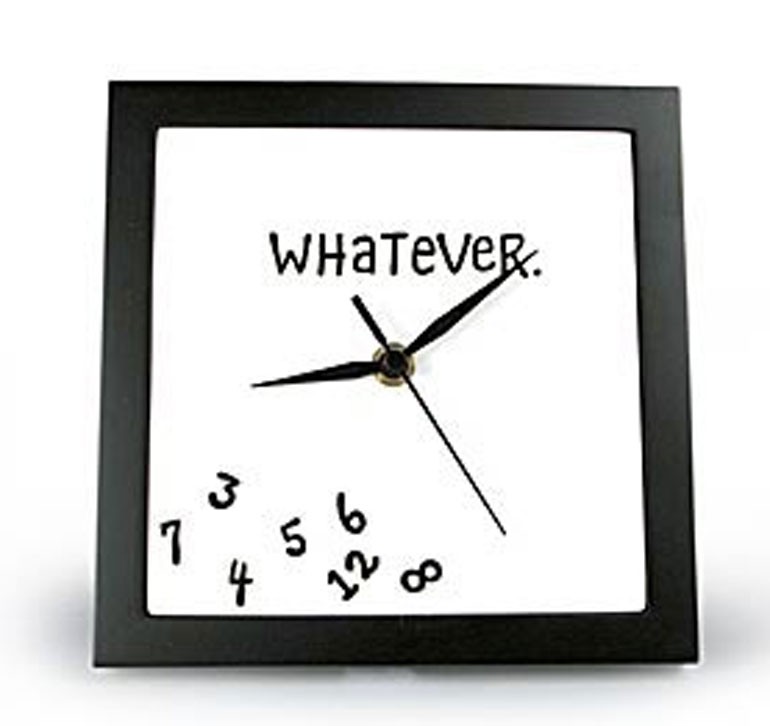
Where is `clockface`? The width and height of the screenshot is (770, 726). clockface is located at coordinates (186, 309).